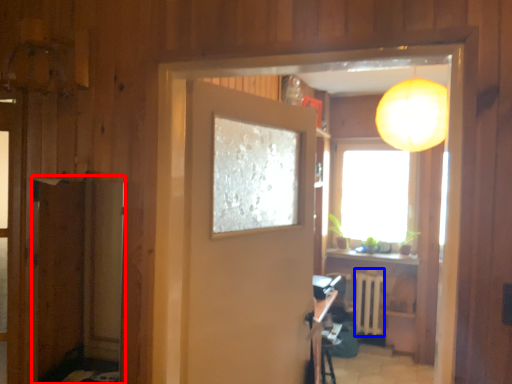
Question: Which point is further to the camera, screen door (highlighted by a red box) or radiator (highlighted by a blue box)?

Choices:
 (A) screen door
 (B) radiator

Answer: (B)